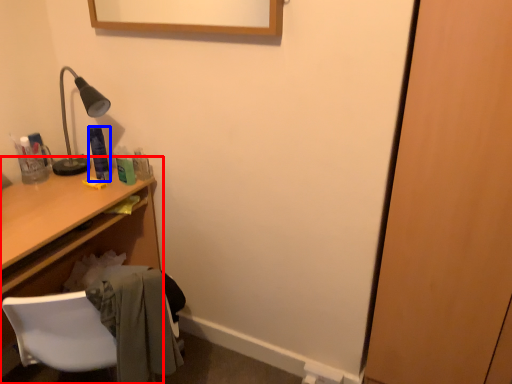
Question: Among these objects, which one is farthest to the camera, desk (highlighted by a red box) or toiletry (highlighted by a blue box)?

Choices:
 (A) desk
 (B) toiletry

Answer: (B)